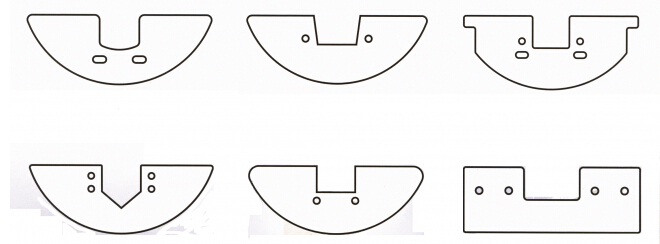
Find the location of a particular element. brackets is located at coordinates (139, 75), (327, 220), (523, 220), (546, 72), (368, 73).